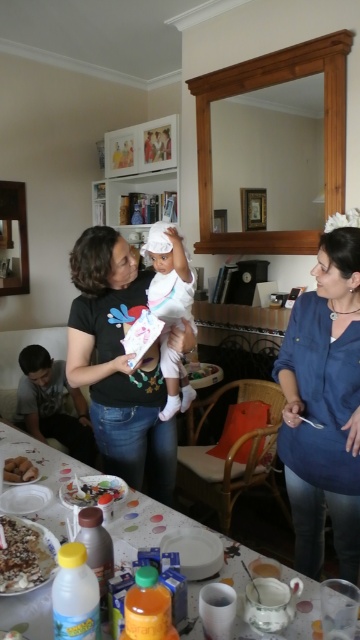
Question: In this image, where is blue fabric shirt at center located relative to brown crumbly cake at lower left?

Choices:
 (A) left
 (B) right

Answer: (B)

Question: Which of the following is the farthest from the observer?

Choices:
 (A) blue fabric shirt at center
 (B) brown crumbly cake at lower left
 (C) white matte baby at center
 (D) smooth plastic tray at lower center

Answer: (C)

Question: Is matte black shirt at center behind brown crumbly cake at lower left?

Choices:
 (A) no
 (B) yes

Answer: (B)

Question: Among these points, which one is farthest from the camera?

Choices:
 (A) (123, 483)
 (B) (36, 522)

Answer: (A)

Question: Can you confirm if matte black shirt at center is positioned to the left of crumbly chocolate cake at lower left?

Choices:
 (A) no
 (B) yes

Answer: (B)

Question: Estimate the real-world distances between objects in this image. Which object is farther from the brown crumbly cake at lower left?

Choices:
 (A) smooth plastic tray at lower center
 (B) white glossy table at center

Answer: (B)